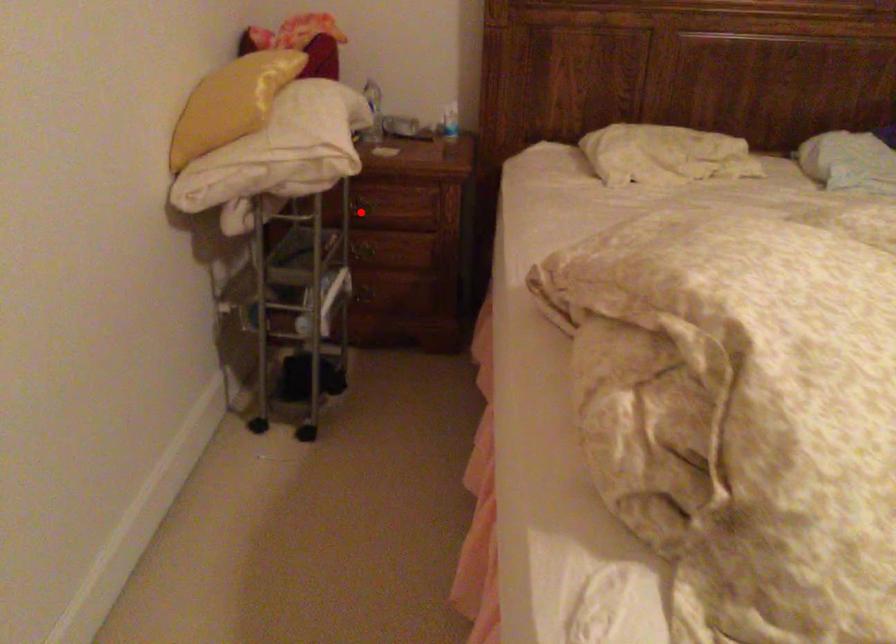
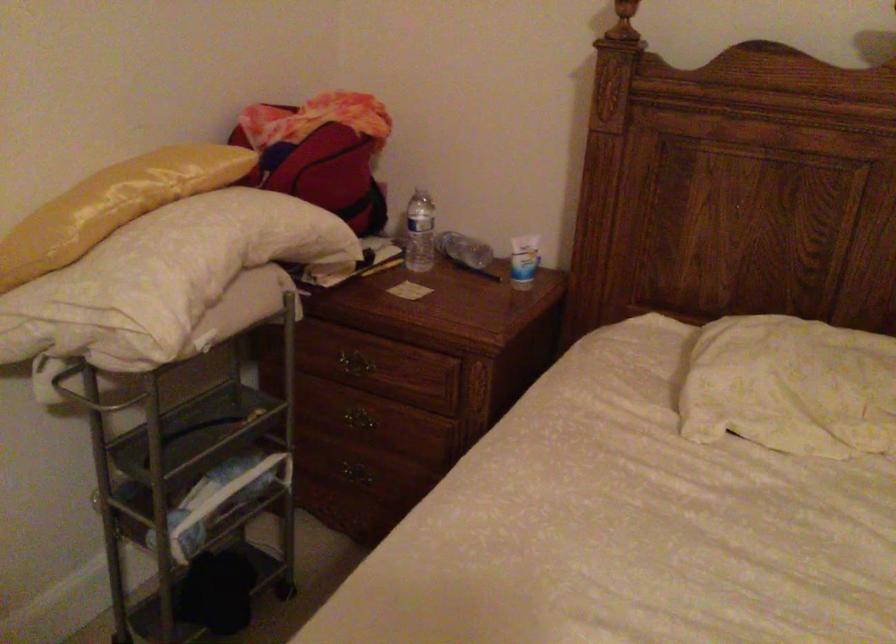
Question: I am providing you with two images of the same scene from different viewpoints. A red point is marked on the first image. Is the red point's position out of view in image 2?

Choices:
 (A) Yes
 (B) No

Answer: (B)